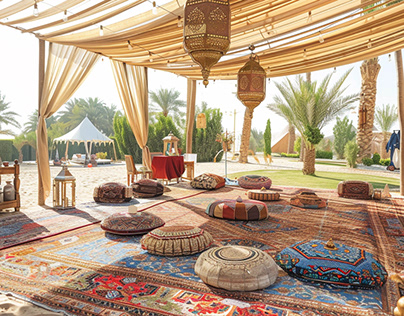
Where is `vase`? The width and height of the screenshot is (404, 316). vase is located at coordinates (5, 187), (1, 195).